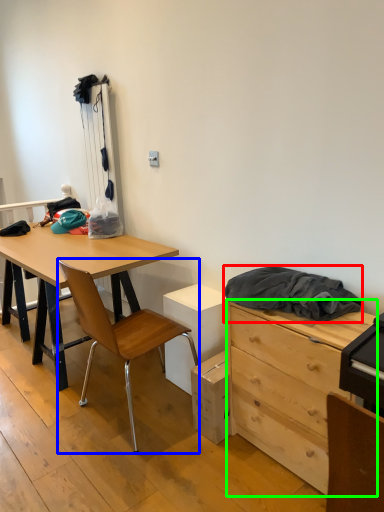
Question: Estimate the real-world distances between objects in this image. Which object is farther from clothing (highlighted by a red box), chair (highlighted by a blue box) or chest of drawers (highlighted by a green box)?

Choices:
 (A) chair
 (B) chest of drawers

Answer: (A)